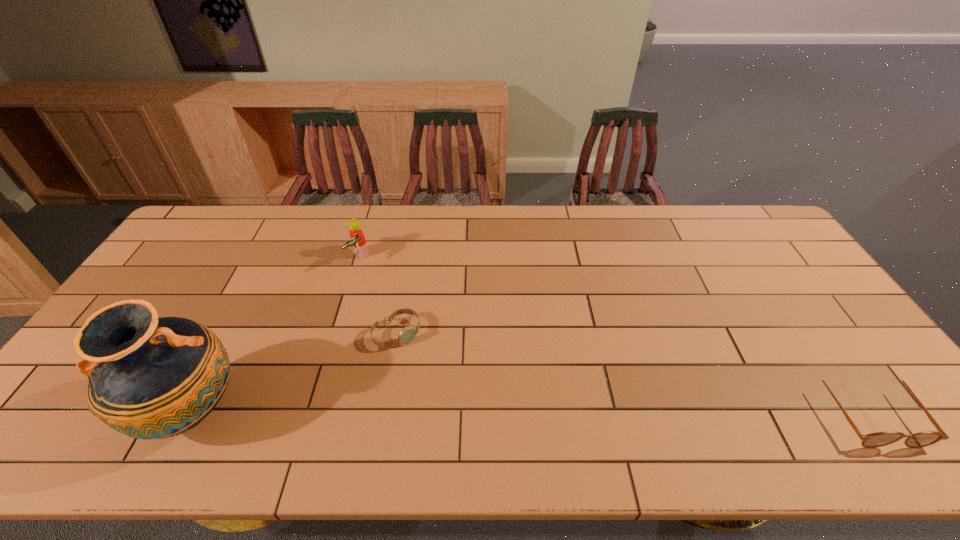
Identify the location of free space between the tallest object and the sunglasses. Image resolution: width=960 pixels, height=540 pixels. (529, 410).

Image resolution: width=960 pixels, height=540 pixels. In order to click on free spot between the third shortest object and the second object from right to left in this screenshot , I will do `click(378, 295)`.

At what (x,y) coordinates should I click in order to perform the action: click on vacant area that lies between the third nearest object and the rightmost object. Please return your answer as a coordinate pair (x, y). This screenshot has height=540, width=960. Looking at the image, I should click on (631, 371).

Locate which object is the second closest to the rightmost object. Please provide its 2D coordinates. Your answer should be formatted as a tuple, i.e. [(x, y)], where the tuple contains the x and y coordinates of a point satisfying the conditions above.

[(357, 238)]

What are the coordinates of `object identified as the second closest to the second farthest object` in the screenshot? It's located at (150, 378).

Locate an element on the screen. free space that satisfies the following two spatial constraints: 1. on the back side of the third shortest object; 2. on the left side of the tallest object is located at coordinates 271,258.